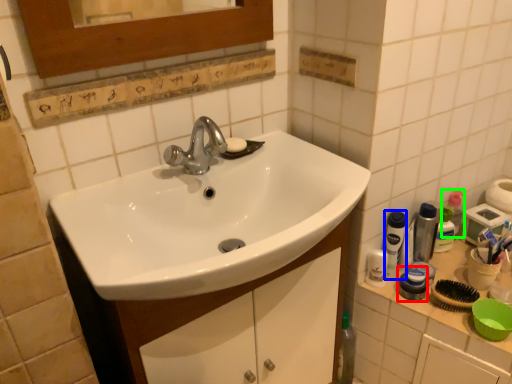
Question: Considering the real-world distances, which object is farthest from mouthwash (highlighted by a red box)? mouthwash (highlighted by a blue box) or mouthwash (highlighted by a green box)?

Choices:
 (A) mouthwash
 (B) mouthwash

Answer: (B)